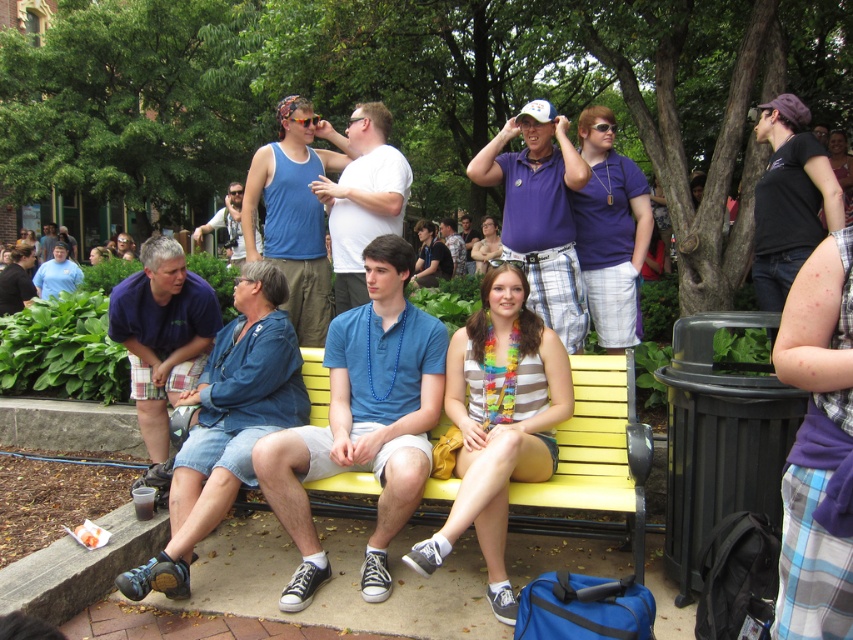
Question: Which point is closer to the camera?

Choices:
 (A) blue cotton tank top at upper center
 (B) purple cotton polo shirt at center

Answer: (B)

Question: Can you confirm if blue plaid shorts at left is smaller than blue cotton tank top at upper center?

Choices:
 (A) yes
 (B) no

Answer: (A)

Question: Can you confirm if purple cotton polo shirt at center is positioned to the right of camouflage-patterned shirt at center?

Choices:
 (A) no
 (B) yes

Answer: (B)

Question: Which point is closer to the camera?

Choices:
 (A) (796, 164)
 (B) (347, 380)

Answer: (B)

Question: Is blue cotton shirt at center further to the viewer compared to camouflage-patterned shirt at center?

Choices:
 (A) yes
 (B) no

Answer: (B)

Question: Which point is farther from the camera taking this photo?

Choices:
 (A) pos(231,259)
 (B) pos(323,257)

Answer: (A)